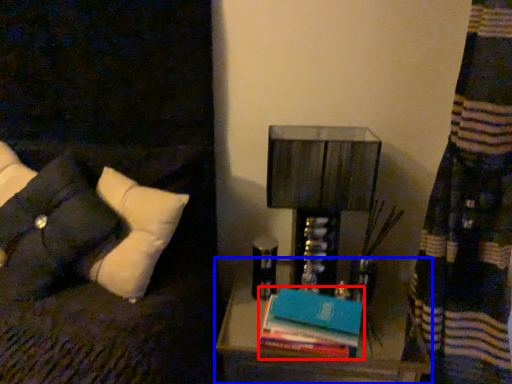
Question: Which object is further to the camera taking this photo, book (highlighted by a red box) or nightstand (highlighted by a blue box)?

Choices:
 (A) book
 (B) nightstand

Answer: (B)